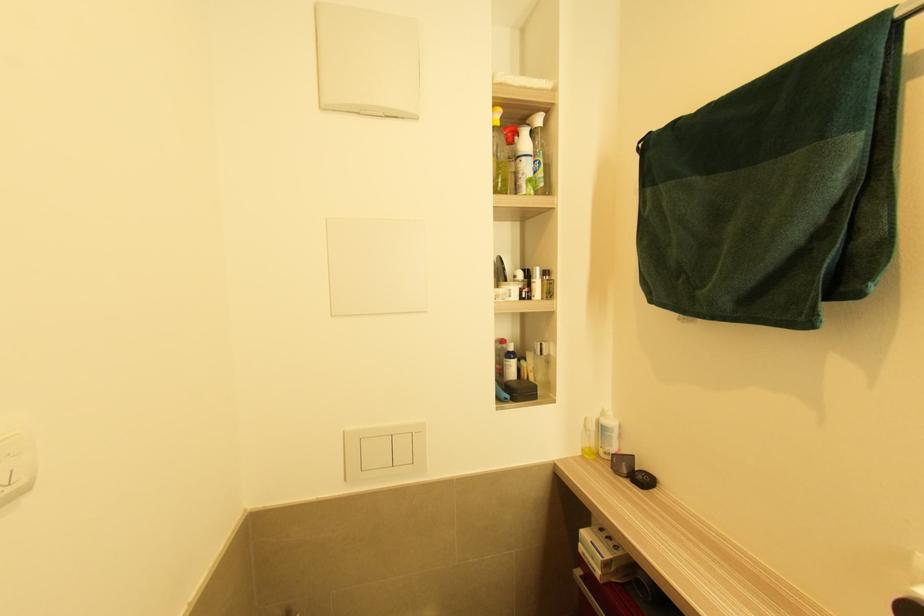
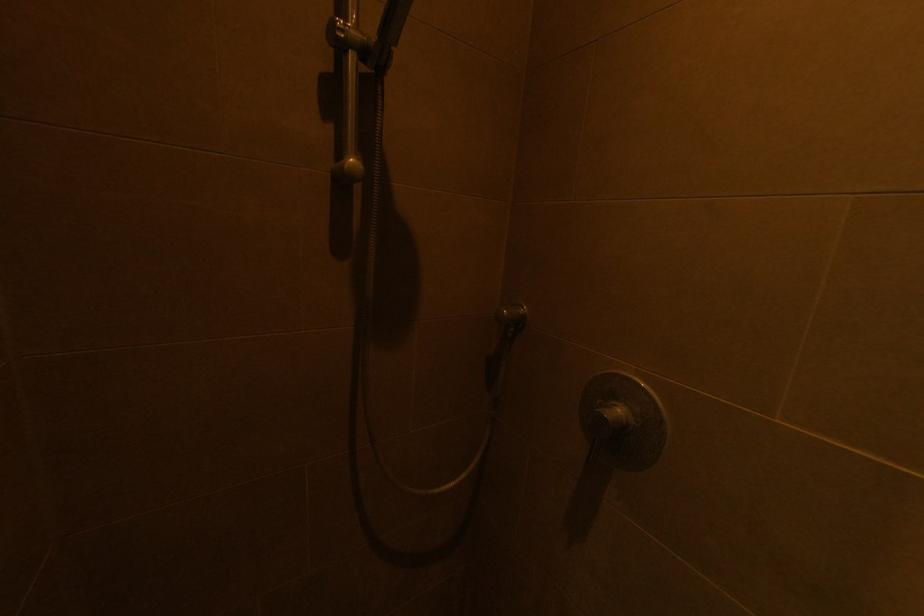
Question: How did the camera likely rotate?

Choices:
 (A) Left
 (B) Right
 (C) Up
 (D) Down

Answer: (B)